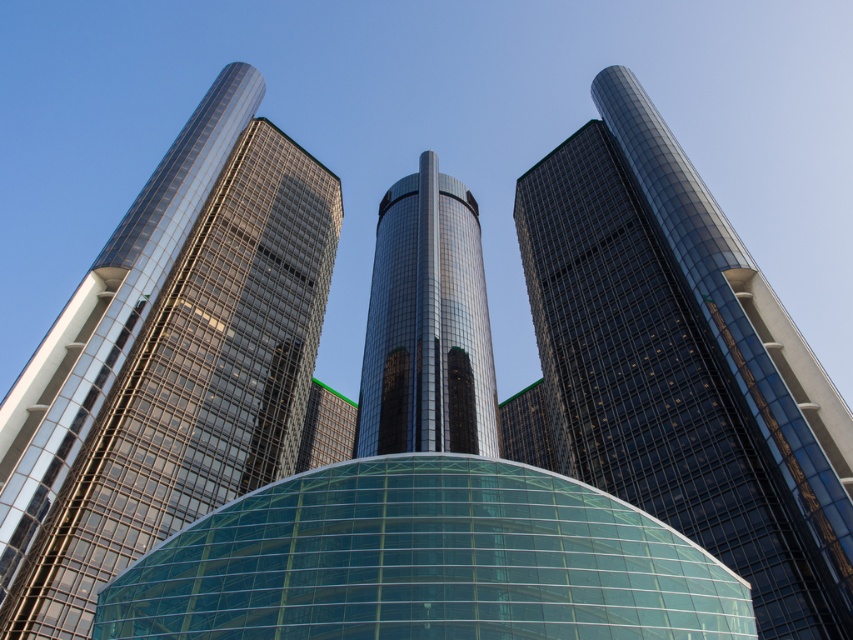
Question: Can you confirm if glossy glass skyscraper at center is thinner than glossy glass tower at center?

Choices:
 (A) yes
 (B) no

Answer: (A)

Question: Which point appears farthest from the camera in this image?

Choices:
 (A) (560, 406)
 (B) (202, 492)
 (C) (480, 269)

Answer: (C)

Question: Is shiny glass skyscraper at center bigger than glossy glass tower at center?

Choices:
 (A) yes
 (B) no

Answer: (B)

Question: Which point is farther from the camera taking this photo?

Choices:
 (A) (236, 460)
 (B) (824, 586)
 (C) (451, 292)

Answer: (C)

Question: Is shiny glass skyscraper at center to the left of glossy glass skyscraper at center from the viewer's perspective?

Choices:
 (A) no
 (B) yes

Answer: (B)

Question: Which of these objects is positioned farthest from the glossy glass tower at center?

Choices:
 (A) glossy glass skyscraper at center
 (B) shiny glass skyscraper at center

Answer: (A)